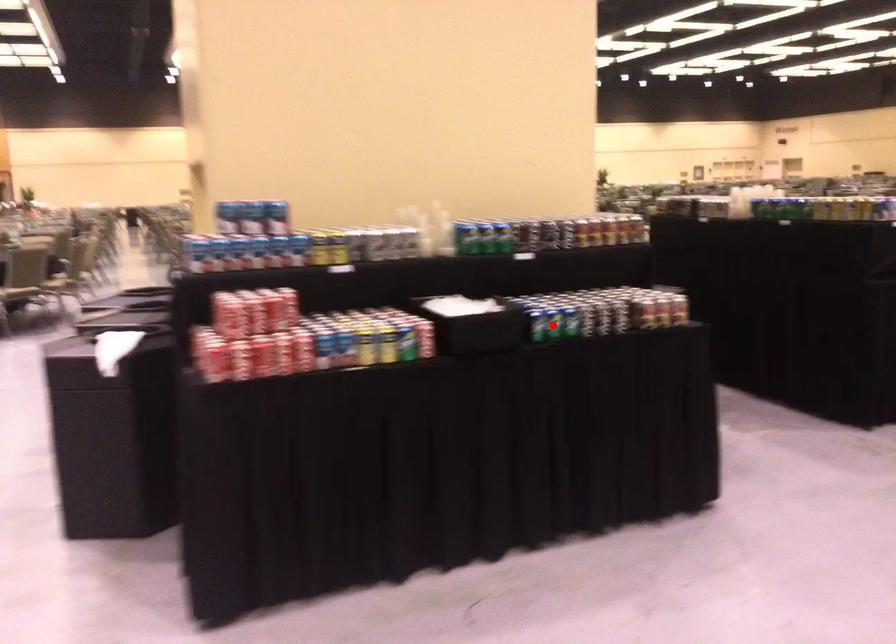
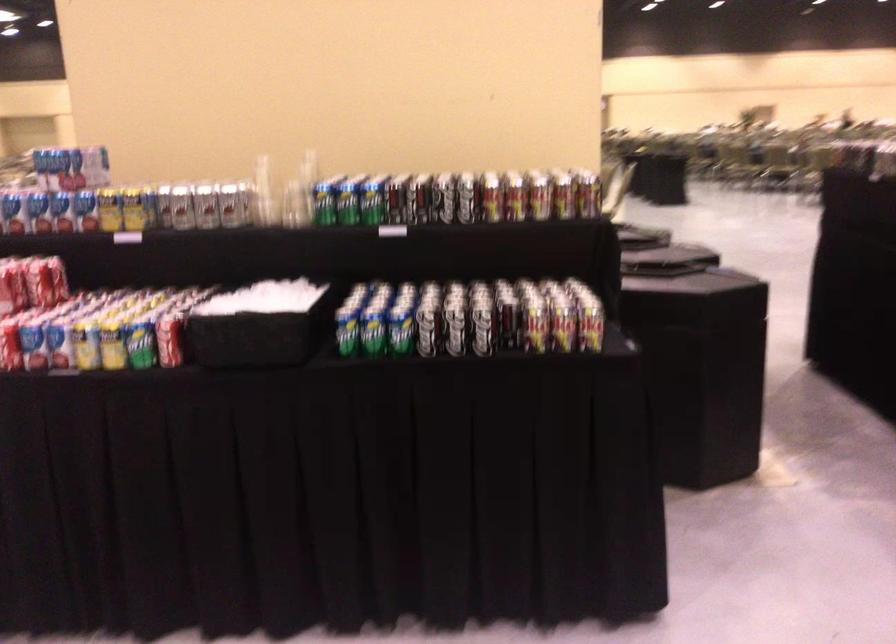
Question: I am providing you with two images of the same scene from different viewpoints. Image1 has a red point marked. In image2, the corresponding 3D location appears at what relative position? Reply with the corresponding letter.

Choices:
 (A) Closer
 (B) Farther

Answer: (A)